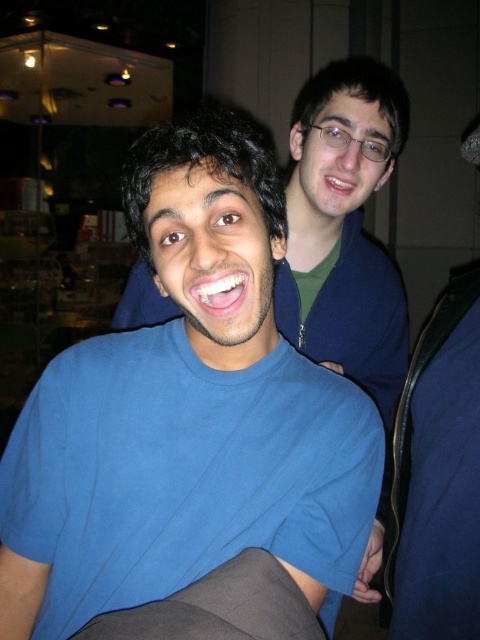
Does blue cotton shirt at center have a greater height compared to white glossy teeth at center?

Yes, blue cotton shirt at center is taller than white glossy teeth at center.

Who is lower down, blue cotton shirt at center or white glossy teeth at center?

blue cotton shirt at center

You are a GUI agent. You are given a task and a screenshot of the screen. Output one action in this format:
    pyautogui.click(x=<x>, y=<y>)
    Task: Click on the blue cotton shirt at center
    
    Given the screenshot: What is the action you would take?
    pyautogui.click(x=186, y=417)

Looking at this image, does blue cotton shirt at center appear on the left side of matte skin at upper right?

Indeed, blue cotton shirt at center is positioned on the left side of matte skin at upper right.

Can you confirm if blue cotton shirt at center is positioned below matte skin at upper right?

Indeed, blue cotton shirt at center is positioned under matte skin at upper right.

Measure the distance between point (284, 212) and camera.

25.80 inches

Where is `blue cotton shirt at center`? This screenshot has height=640, width=480. blue cotton shirt at center is located at coordinates (186, 417).

Does point (235, 310) come behind point (354, 179)?

That is False.

I want to click on white glossy teeth at center, so click(x=216, y=292).